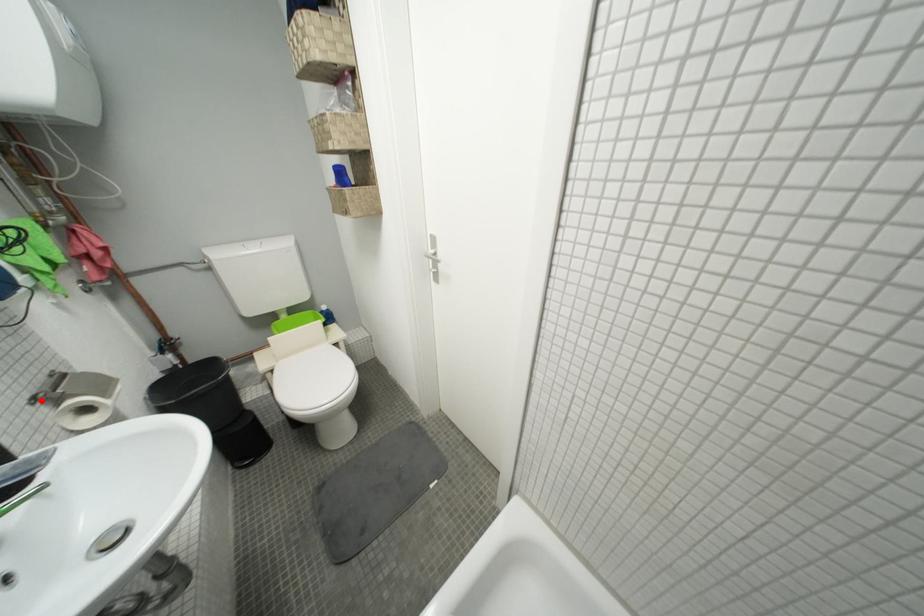
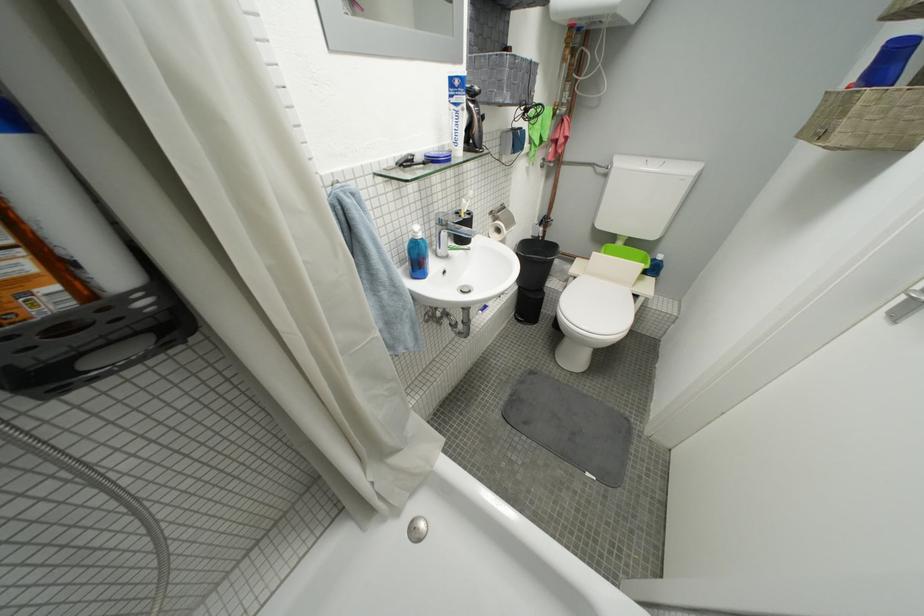
Locate, in the second image, the point that corresponds to the highlighted location in the first image.

(500, 214)